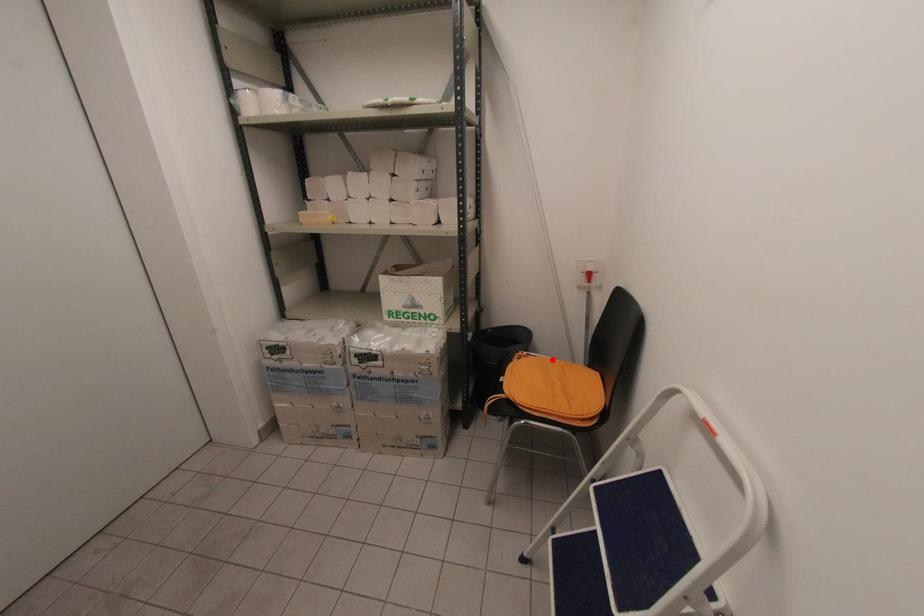
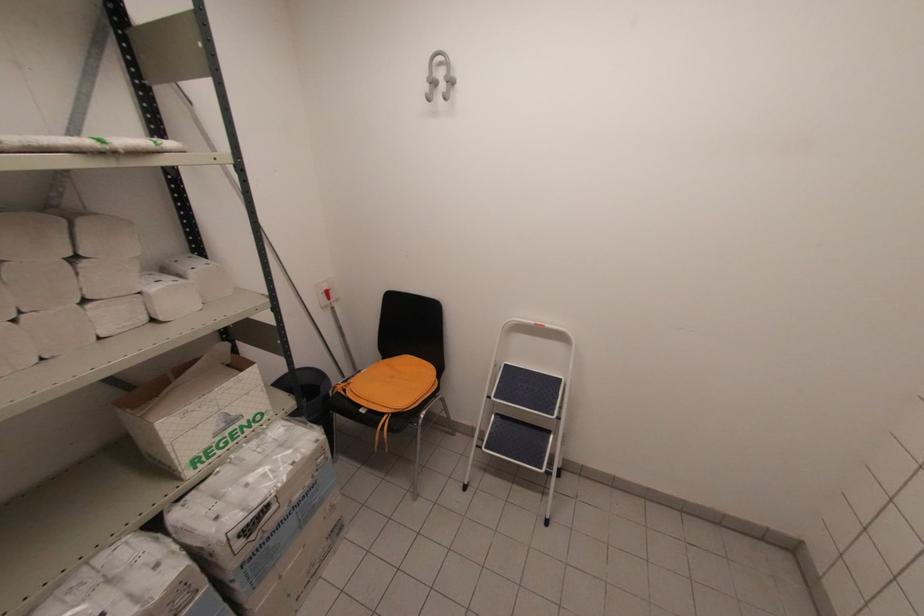
The point at the highlighted location is marked in the first image. Where is the corresponding point in the second image?

(362, 371)